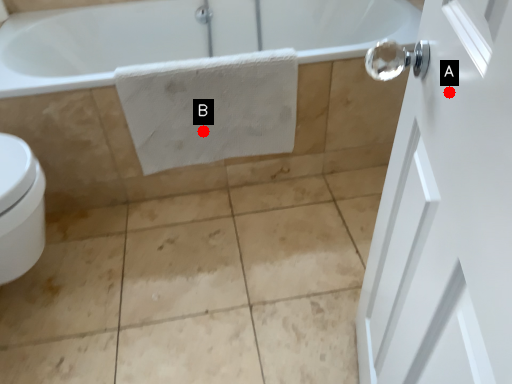
Question: Two points are circled on the image, labeled by A and B beside each circle. Which of the following is the farthest from the observer?

Choices:
 (A) A is further
 (B) B is further

Answer: (B)